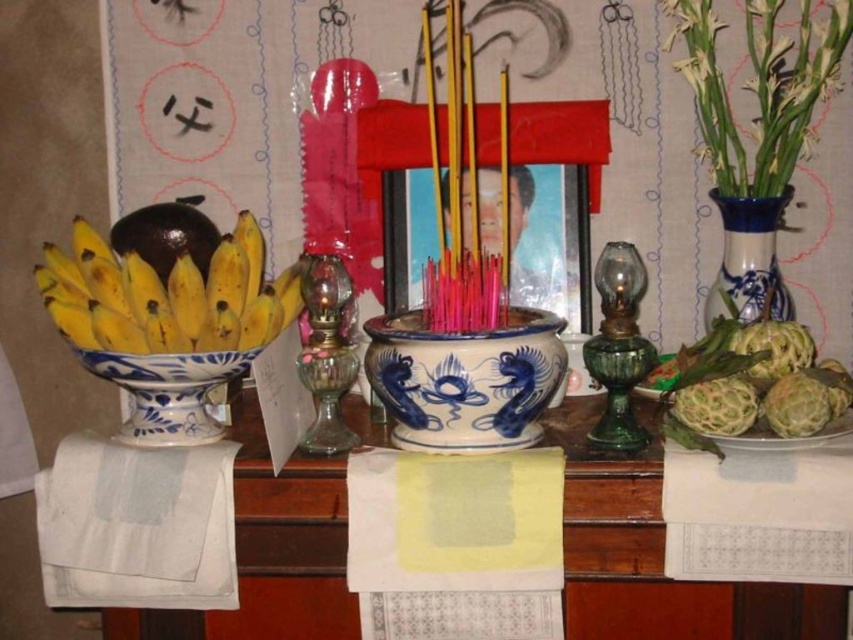
Question: Considering the relative positions of yellow paper at center and green glass oil lamp at right in the image provided, where is yellow paper at center located with respect to green glass oil lamp at right?

Choices:
 (A) right
 (B) left

Answer: (B)

Question: Does green glossy vase at upper right have a smaller size compared to blue and white ceramic vase at right?

Choices:
 (A) no
 (B) yes

Answer: (A)

Question: Which point is farther to the camera?

Choices:
 (A) (762, 259)
 (B) (136, 349)
 (C) (526, 394)
 (D) (791, 147)

Answer: (D)

Question: Which object is positioned closest to the blue and white ceramic vase at right?

Choices:
 (A) white paper at center
 (B) white cotton cloth at lower left
 (C) yellow matte bananas at left

Answer: (A)

Question: Is yellow paper at center wider than white cotton cloth at lower left?

Choices:
 (A) no
 (B) yes

Answer: (A)

Question: Which object is the closest to the blue and white ceramic bowl at center?

Choices:
 (A) blue and white porcelain bowl at left
 (B) yellow matte bananas at left
 (C) transparent glass candle holder at center

Answer: (C)